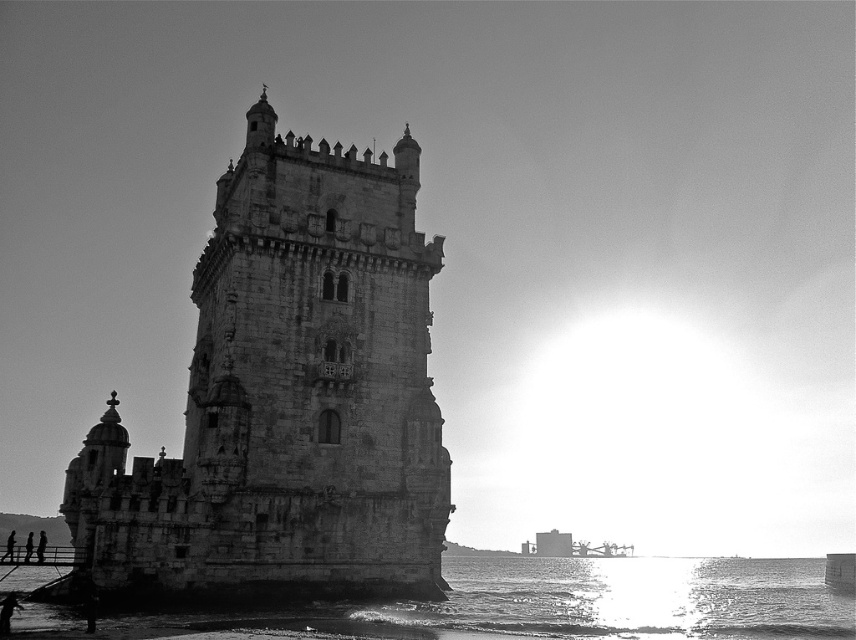
Question: Is stone tower at center above reflective silver water at lower center?

Choices:
 (A) no
 (B) yes

Answer: (B)

Question: Does stone tower at center lie behind reflective silver water at lower center?

Choices:
 (A) yes
 (B) no

Answer: (A)

Question: Which object is farther from the camera taking this photo?

Choices:
 (A) stone tower at center
 (B) reflective silver water at lower center

Answer: (A)

Question: Among these points, which one is nearest to the camera?

Choices:
 (A) coord(388,573)
 (B) coord(229,616)

Answer: (B)

Question: Which point is farther from the camera taking this photo?

Choices:
 (A) (736, 611)
 (B) (203, 269)

Answer: (A)

Question: Does stone tower at center appear on the right side of reflective silver water at lower center?

Choices:
 (A) no
 (B) yes

Answer: (A)